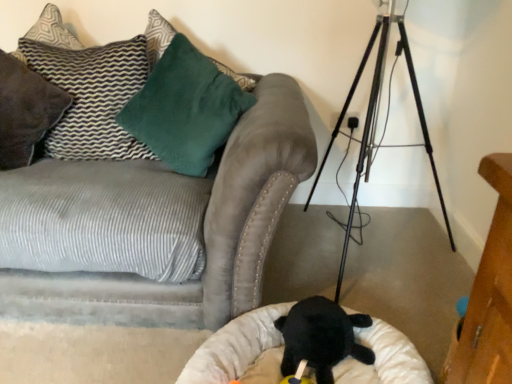
Locate an element on the screen. soft plush toy at center is located at coordinates (300, 375).

The height and width of the screenshot is (384, 512). I want to click on black plush toy at lower center, so click(321, 337).

This screenshot has width=512, height=384. Describe the element at coordinates (234, 346) in the screenshot. I see `white plush cat bed at lower center` at that location.

Describe the element at coordinates (376, 118) in the screenshot. I see `metallic tripod at center` at that location.

Locate an element on the screen. The height and width of the screenshot is (384, 512). metallic tripod at center is located at coordinates (376, 118).

How much space does velvety green pillow at upper left, which is the second pillow from left to right, occupy vertically?

The height of velvety green pillow at upper left, which is the second pillow from left to right, is 22.13 inches.

I want to click on suede gray couch at upper left, so click(x=202, y=231).

Identify the location of textured gray pillow at upper left, positioned as the second pillow in right-to-left order. The height and width of the screenshot is (384, 512). (92, 97).

From the image's perspective, would you say textured gray pillow at upper left, positioned as the second pillow in right-to-left order, is shown under metallic tripod at center?

Actually, textured gray pillow at upper left, positioned as the second pillow in right-to-left order, appears above metallic tripod at center in the image.

Which is in front, point (57, 74) or point (362, 171)?

The point (57, 74) is more forward.

Is textured gray pillow at upper left, which is the first pillow from left to right, bigger or smaller than metallic tripod at center?

Considering their sizes, textured gray pillow at upper left, which is the first pillow from left to right, takes up less space than metallic tripod at center.

Is textured gray pillow at upper left, positioned as the second pillow in right-to-left order, to the left of metallic tripod at center from the viewer's perspective?

Yes, textured gray pillow at upper left, positioned as the second pillow in right-to-left order, is to the left of metallic tripod at center.

Does soft plush toy at center have a greater width compared to white plush cat bed at lower center?

No, soft plush toy at center is not wider than white plush cat bed at lower center.

Does soft plush toy at center appear on the left side of white plush cat bed at lower center?

Indeed, soft plush toy at center is positioned on the left side of white plush cat bed at lower center.

Between soft plush toy at center and white plush cat bed at lower center, which one has smaller size?

Smaller between the two is soft plush toy at center.

Is soft plush toy at center placed right next to white plush cat bed at lower center?

No.

Is textured gray pillow at upper left, positioned as the second pillow in right-to-left order, inside the boundaries of suede gray couch at upper left, or outside?

textured gray pillow at upper left, positioned as the second pillow in right-to-left order, is inside suede gray couch at upper left.

From the picture: Is the depth of textured gray pillow at upper left, positioned as the second pillow in right-to-left order, less than that of suede gray couch at upper left?

No.

Locate an element on the screen. The image size is (512, 384). the 2nd pillow behind the suede gray couch at upper left is located at coordinates (92, 97).

From a real-world perspective, which object rests below the other?

In real-world perspective, suede gray couch at upper left is lower.

Considering the sizes of metallic tripod at center and velvety green pillow at upper left, arranged as the 1th pillow when viewed from the right, in the image, is metallic tripod at center wider or thinner than velvety green pillow at upper left, arranged as the 1th pillow when viewed from the right,?

Considering their sizes, metallic tripod at center looks broader than velvety green pillow at upper left, arranged as the 1th pillow when viewed from the right.

How many degrees apart are the facing directions of metallic tripod at center and velvety green pillow at upper left, arranged as the 1th pillow when viewed from the right?

26.1 degrees separate the facing orientations of metallic tripod at center and velvety green pillow at upper left, arranged as the 1th pillow when viewed from the right.

Is metallic tripod at center behind velvety green pillow at upper left, arranged as the 1th pillow when viewed from the right?

No, it is in front of velvety green pillow at upper left, arranged as the 1th pillow when viewed from the right.

From the image's perspective, which one is positioned lower, metallic tripod at center or velvety green pillow at upper left, which is the second pillow from left to right?

metallic tripod at center appears lower in the image.

Considering the sizes of objects white plush cat bed at lower center and velvety green pillow at upper left, which is the second pillow from left to right, in the image provided, who is shorter, white plush cat bed at lower center or velvety green pillow at upper left, which is the second pillow from left to right,?

Standing shorter between the two is white plush cat bed at lower center.

Visually, is white plush cat bed at lower center positioned to the left or to the right of velvety green pillow at upper left, arranged as the 1th pillow when viewed from the right?

Based on their positions, white plush cat bed at lower center is located to the right of velvety green pillow at upper left, arranged as the 1th pillow when viewed from the right.

From a real-world perspective, which object stands above the other?

velvety green pillow at upper left, arranged as the 1th pillow when viewed from the right, from a real-world perspective.

Is soft plush toy at center located outside velvety green pillow at upper left, which is the second pillow from left to right?

Yes, soft plush toy at center is not within velvety green pillow at upper left, which is the second pillow from left to right.

Is velvety green pillow at upper left, which is the second pillow from left to right, at the back of soft plush toy at center?

No, velvety green pillow at upper left, which is the second pillow from left to right, is not at the back of soft plush toy at center.

Can you see soft plush toy at center touching velvety green pillow at upper left, which is the second pillow from left to right?

soft plush toy at center and velvety green pillow at upper left, which is the second pillow from left to right, are not in contact.

Does soft plush toy at center have a greater width compared to velvety green pillow at upper left, which is the second pillow from left to right?

Incorrect, the width of soft plush toy at center does not surpass that of velvety green pillow at upper left, which is the second pillow from left to right.

Visually, is velvety green pillow at upper left, which is the second pillow from left to right, positioned to the left or to the right of metallic tripod at center?

In the image, velvety green pillow at upper left, which is the second pillow from left to right, appears on the left side of metallic tripod at center.

Can you tell me how much velvety green pillow at upper left, arranged as the 1th pillow when viewed from the right, and metallic tripod at center differ in facing direction?

26.1 degrees.

Which is closer, (193,94) or (385,31)?

Point (193,94) appears to be closer to the viewer than point (385,31).

From a real-world perspective, is velvety green pillow at upper left, which is the second pillow from left to right, over metallic tripod at center?

Yes, from a real-world perspective, velvety green pillow at upper left, which is the second pillow from left to right, is over metallic tripod at center

This screenshot has width=512, height=384. What are the coordinates of `tripod in front of the textured gray pillow at upper left, positioned as the second pillow in right-to-left order` in the screenshot? It's located at (376, 118).

Where is `toy that appears on the left of white plush cat bed at lower center`? The height and width of the screenshot is (384, 512). toy that appears on the left of white plush cat bed at lower center is located at coordinates (300, 375).

From the image, which object appears to be nearer to white plush cat bed at lower center, textured gray pillow at upper left, which is the first pillow from left to right, or soft plush toy at center?

soft plush toy at center lies closer to white plush cat bed at lower center than the other object.

From the image, which object appears to be nearer to white plush cat bed at lower center, velvety green pillow at upper left, arranged as the 1th pillow when viewed from the right, or textured gray pillow at upper left, positioned as the second pillow in right-to-left order?

velvety green pillow at upper left, arranged as the 1th pillow when viewed from the right, is closer to white plush cat bed at lower center.

From the image, which object appears to be nearer to soft plush toy at center, black plush toy at lower center or white plush cat bed at lower center?

black plush toy at lower center is positioned closer to the anchor soft plush toy at center.

Which object lies nearer to the anchor point white plush cat bed at lower center, metallic tripod at center or velvety green pillow at upper left, which is the second pillow from left to right?

velvety green pillow at upper left, which is the second pillow from left to right.

When comparing their distances from white plush cat bed at lower center, does suede gray couch at upper left or black plush toy at lower center seem closer?

The object closer to white plush cat bed at lower center is black plush toy at lower center.

Based on their spatial positions, is metallic tripod at center or white plush cat bed at lower center further from black plush toy at lower center?

Among the two, metallic tripod at center is located further to black plush toy at lower center.

Considering their positions, is textured gray pillow at upper left, positioned as the second pillow in right-to-left order, positioned closer to soft plush toy at center than velvety green pillow at upper left, which is the second pillow from left to right?

Answer: velvety green pillow at upper left, which is the second pillow from left to right, lies closer to soft plush toy at center than the other object.

Looking at the image, which one is located closer to black plush toy at lower center, white plush cat bed at lower center or textured gray pillow at upper left, positioned as the second pillow in right-to-left order?

Based on the image, white plush cat bed at lower center appears to be nearer to black plush toy at lower center.

At what (x,y) coordinates should I click in order to perform the action: click on tripod between velvety green pillow at upper left, which is the second pillow from left to right, and white plush cat bed at lower center vertically. Please return your answer as a coordinate pair (x, y). Looking at the image, I should click on (376, 118).

This screenshot has width=512, height=384. I want to click on dog between metallic tripod at center and soft plush toy at center in the up-down direction, so click(321, 337).

You are a GUI agent. You are given a task and a screenshot of the screen. Output one action in this format:
    pyautogui.click(x=<x>, y=<y>)
    Task: Click on the pillow situated between suede gray couch at upper left and metallic tripod at center from left to right
    The image size is (512, 384).
    Given the screenshot: What is the action you would take?
    [185, 109]

I want to click on studio couch between textured gray pillow at upper left, positioned as the second pillow in right-to-left order, and soft plush toy at center in the up-down direction, so click(x=202, y=231).